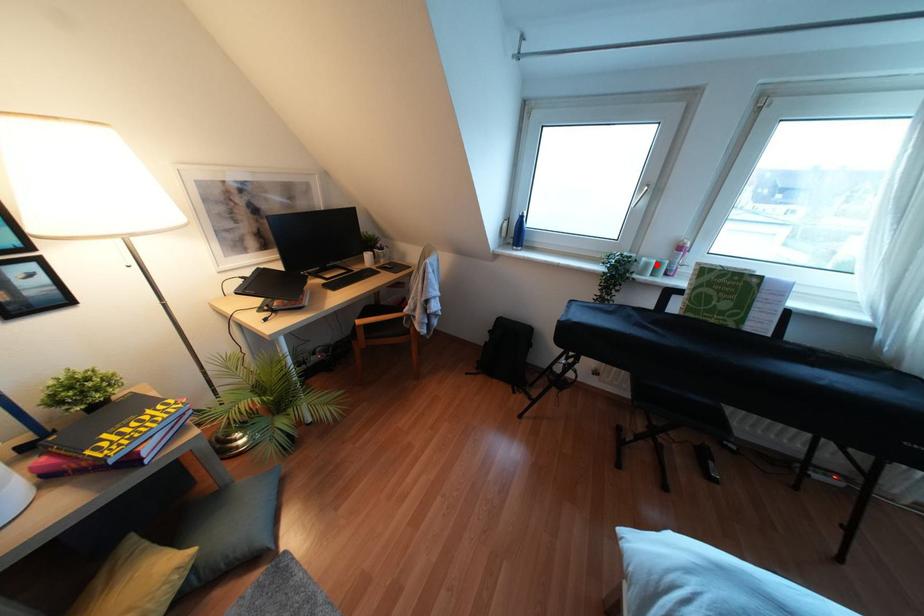
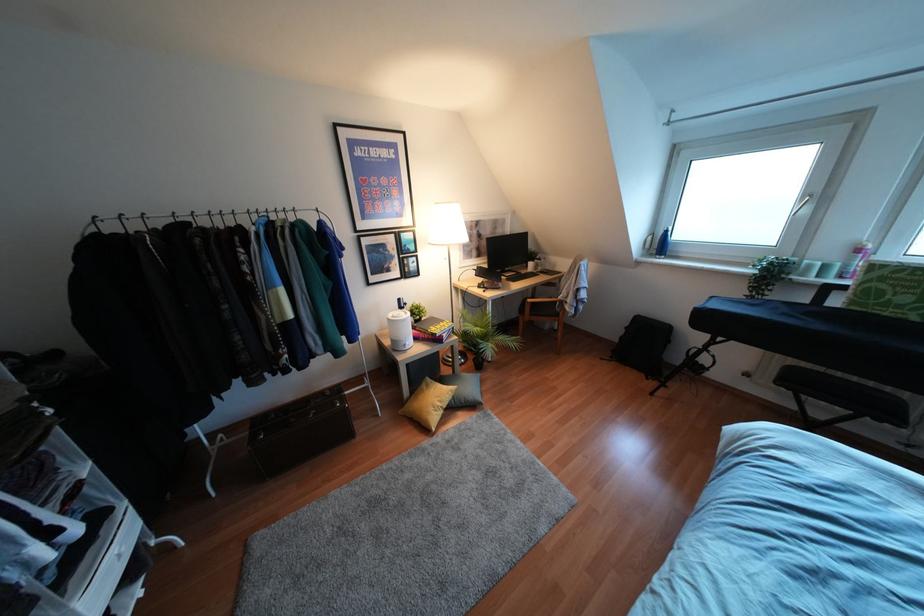
In the second image, find the point that corresponds to the highlighted location in the first image.

(824, 267)